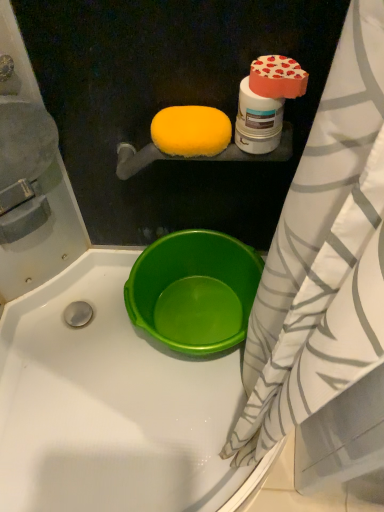
Question: From a real-world perspective, is yellow sponge at upper center, the second food positioned from the front, above or below white striped fabric at right?

Choices:
 (A) below
 (B) above

Answer: (B)

Question: In terms of height, does yellow sponge at upper center, the second food positioned from the front, look taller or shorter compared to white striped fabric at right?

Choices:
 (A) short
 (B) tall

Answer: (A)

Question: Estimate the real-world distances between objects in this image. Which object is farther from the smooth matte heart-shaped box at upper right, the 2th food from the left?

Choices:
 (A) white striped fabric at right
 (B) green plastic basin at lower center
 (C) yellow sponge at upper center, the second food positioned from the front

Answer: (B)

Question: Which object is the closest to the yellow sponge at upper center, the second food positioned from the front?

Choices:
 (A) white striped fabric at right
 (B) smooth matte heart-shaped box at upper right, which is counted as the 1th food, starting from the right
 (C) green plastic basin at lower center

Answer: (B)